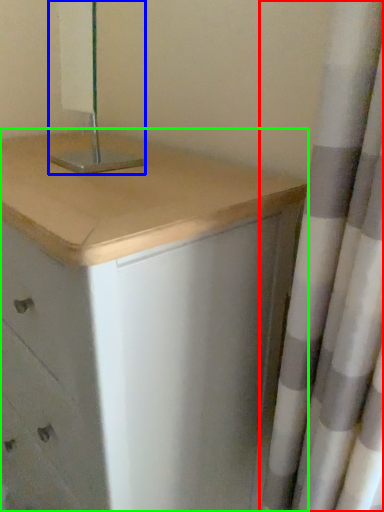
Question: Based on their relative distances, which object is farther from curtain (highlighted by a red box)? Choose from bedside lamp (highlighted by a blue box) and chest of drawers (highlighted by a green box).

Choices:
 (A) bedside lamp
 (B) chest of drawers

Answer: (A)